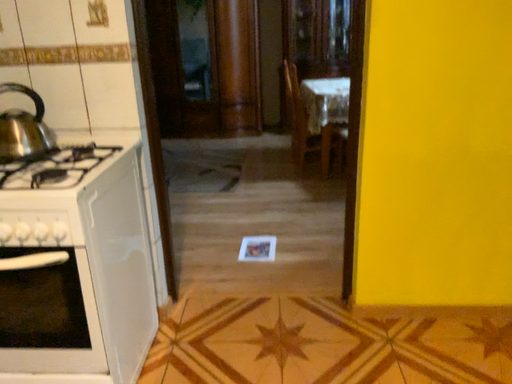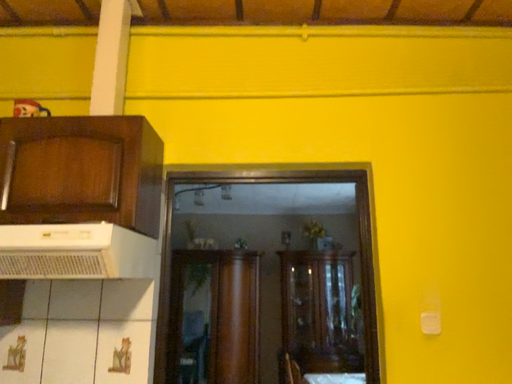
Question: Which way did the camera rotate in the video?

Choices:
 (A) rotated upward
 (B) rotated downward

Answer: (A)